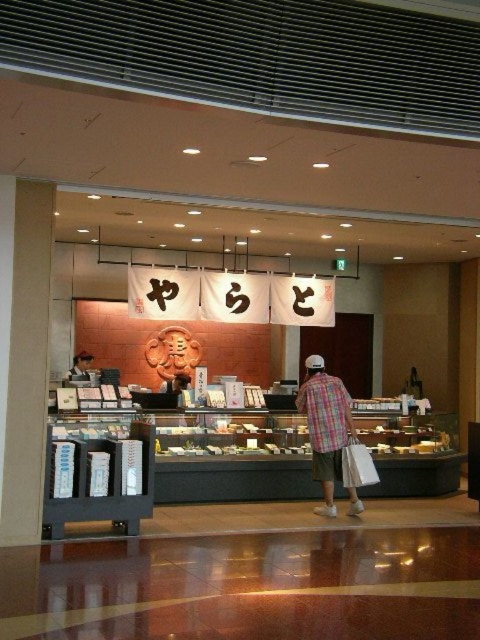
Does plaid fabric shirt at center lie in front of matte black shirt at center?

Yes, plaid fabric shirt at center is closer to the viewer.

Can you confirm if plaid fabric shirt at center is bigger than matte black shirt at center?

Correct, plaid fabric shirt at center is larger in size than matte black shirt at center.

Where is `plaid fabric shirt at center`? The width and height of the screenshot is (480, 640). plaid fabric shirt at center is located at coordinates (325, 426).